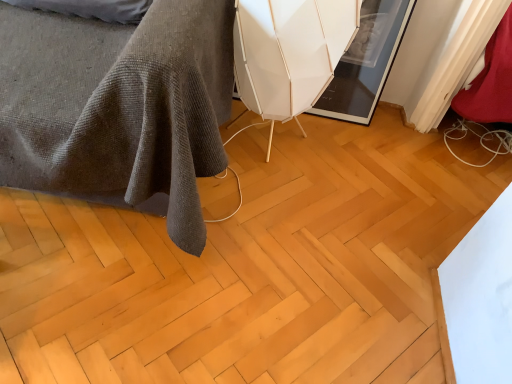
The width and height of the screenshot is (512, 384). Find the location of `free space to the right of white matte swivel chair at center`. free space to the right of white matte swivel chair at center is located at coordinates (352, 165).